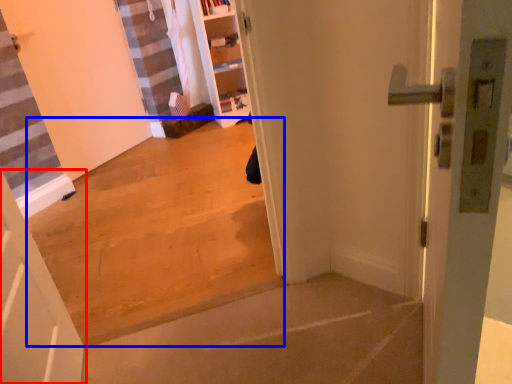
Question: Which of the following is the closest to the observer, door (highlighted by a red box) or concrete (highlighted by a blue box)?

Choices:
 (A) door
 (B) concrete

Answer: (A)